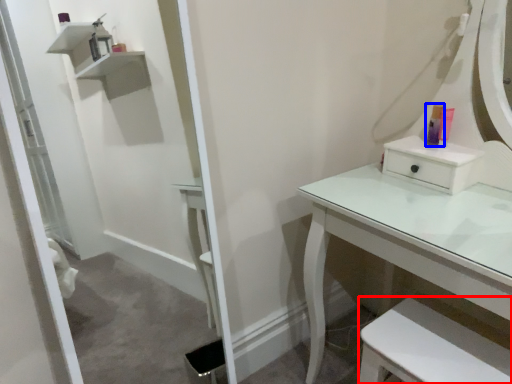
Question: Which of the following is the farthest to the observer, step stool (highlighted by a red box) or toiletry (highlighted by a blue box)?

Choices:
 (A) step stool
 (B) toiletry

Answer: (B)